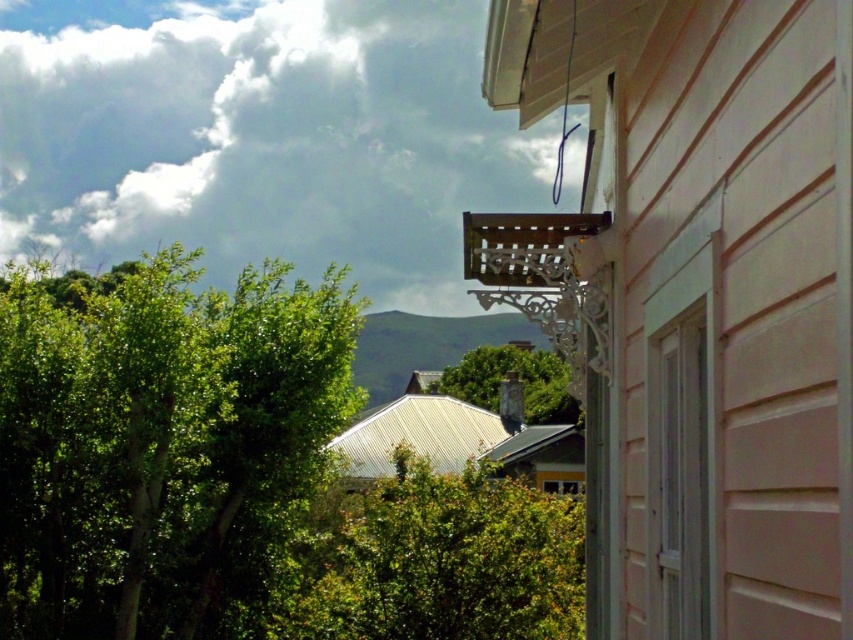
Based on the scene described, which object is taller between the green leafy bush at center and the green leafy tree at center?

The green leafy bush at center is taller than the green leafy tree at center according to the description.

You are standing in the middle of the scene and want to walk towards the green leafy bush at center and the green leafy tree at center. Which one is wider?

The green leafy bush at center is wider than the green leafy tree at center because its width surpasses the tree.

You are standing in the garden looking at the green leafy bush at center and the green leafy tree at center. Which one is closer to the ground?

The green leafy bush at center is closer to the ground because it is located below the green leafy tree at center.